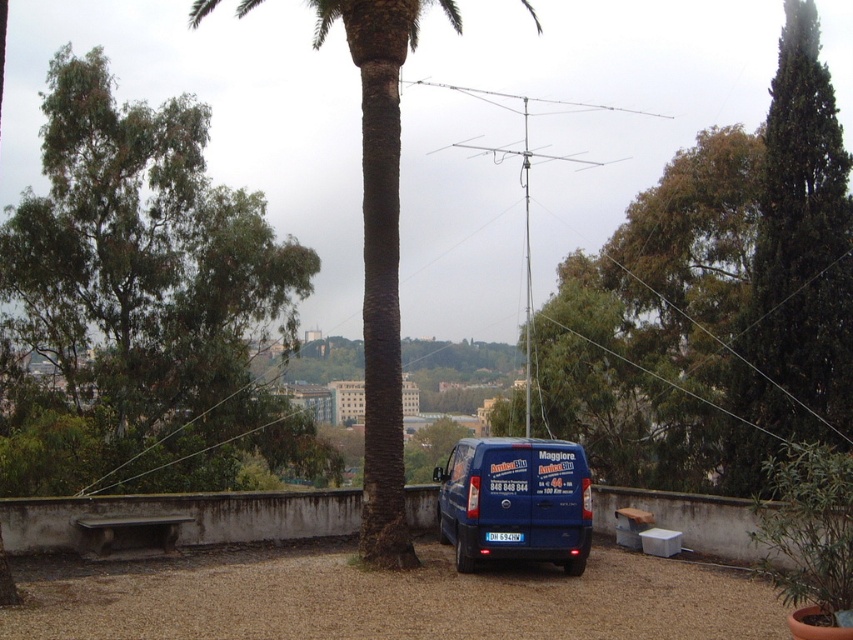
Question: Can you confirm if green leafy tree at left is positioned to the left of green textured palm tree at center?

Choices:
 (A) yes
 (B) no

Answer: (A)

Question: Which object appears farthest from the camera in this image?

Choices:
 (A) green textured palm tree at center
 (B) blue matte van at center

Answer: (A)

Question: Among these objects, which one is nearest to the camera?

Choices:
 (A) blue matte van at center
 (B) green textured palm tree at center
 (C) green leafy tree at left

Answer: (A)

Question: From the image, what is the correct spatial relationship of green textured palm tree at center in relation to blue matte van at center?

Choices:
 (A) right
 (B) left

Answer: (B)

Question: Does green textured palm tree at center appear over blue matte van at center?

Choices:
 (A) yes
 (B) no

Answer: (A)

Question: Which of the following is the closest to the observer?

Choices:
 (A) green leafy tree at left
 (B) blue matte van at center
 (C) green textured palm tree at center

Answer: (B)